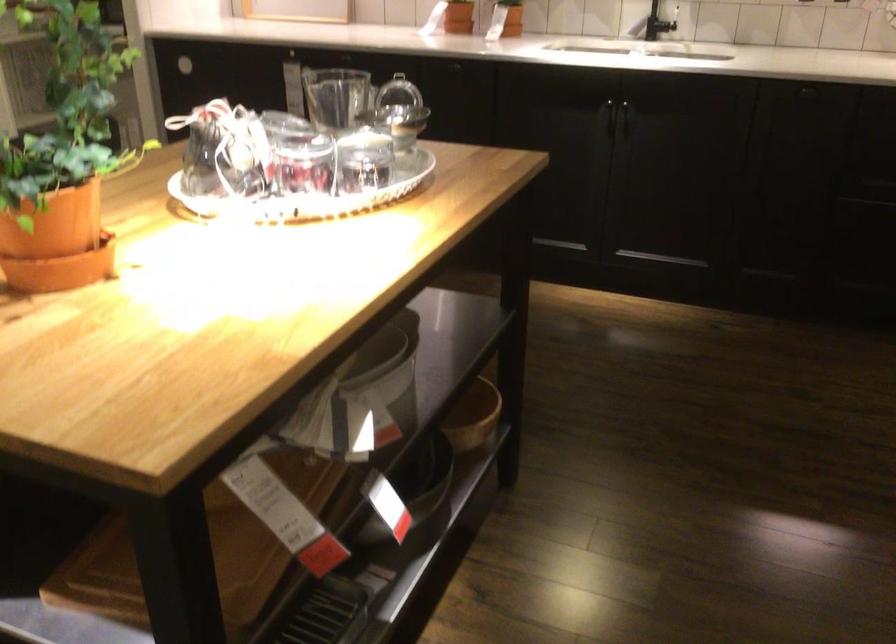
Image resolution: width=896 pixels, height=644 pixels. What do you see at coordinates (334, 96) in the screenshot?
I see `the pitcher handle` at bounding box center [334, 96].